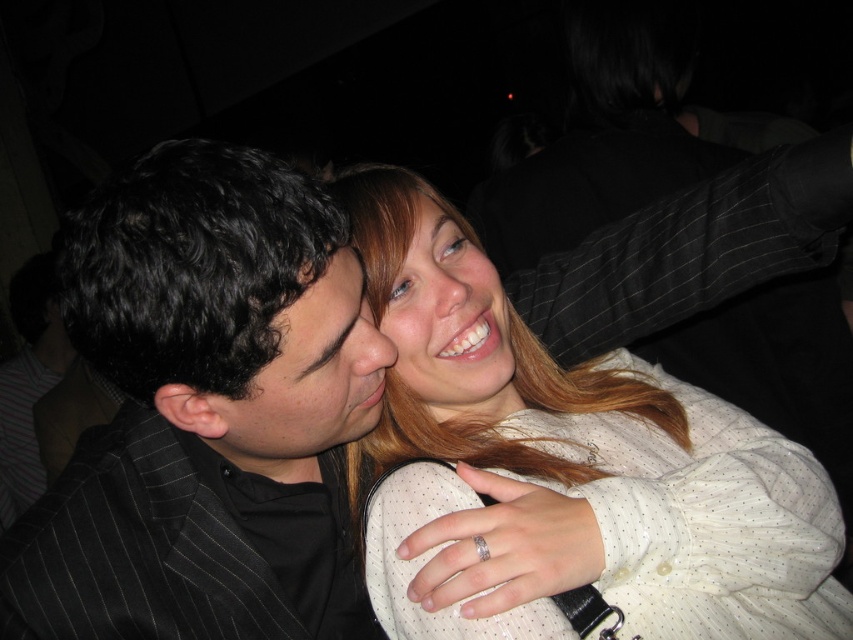
From the picture: You are at a party and want to introduce yourself to the person wearing the smooth cream blouse at center. Which direction should you move to approach them from the matte black face at center?

Since the matte black face at center is to the left of the smooth cream blouse at center, you should move to the right to approach the person wearing the smooth cream blouse at center from the matte black face at center.

You are taking a photo of two people in a dimly lit room. You notice two points in the image labeled as point 1 at coordinates point [112,572] and point 2 at coordinates point [482,406]. Which point is closer to the camera?

Point [112,572] is closer to the camera than point [482,406].

You are organizing a charity event and need to arrange two items on a narrow table. You have a white dotted shirt at center and a smooth cream blouse at center. Given the table space, which item should you place first to ensure both fit?

The smooth cream blouse at center has a smaller width compared to the white dotted shirt at center. Place the wider white dotted shirt at center first, then the narrower smooth cream blouse at center to optimize space and ensure both fit on the narrow table.